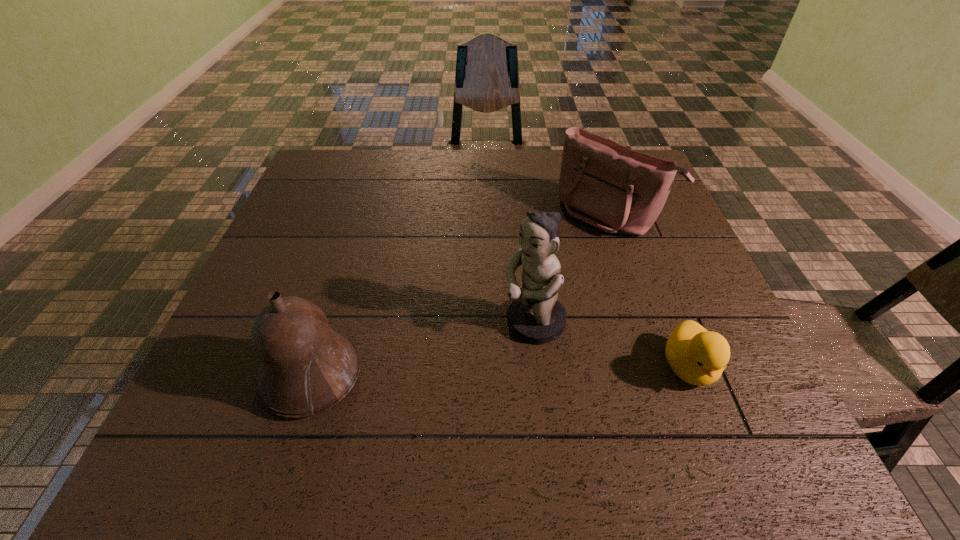
Locate an element on the screen. object that is at the near right corner is located at coordinates (697, 356).

The image size is (960, 540). In order to click on vacant space at the far edge in this screenshot , I will do `click(556, 162)`.

This screenshot has height=540, width=960. In the image, there is a desktop. Identify the location of vacant space at the near edge. (356, 409).

Find the location of a particular element. Image resolution: width=960 pixels, height=540 pixels. free space at the left edge of the desktop is located at coordinates (300, 196).

Image resolution: width=960 pixels, height=540 pixels. Identify the location of vacant area at the right edge. (686, 314).

In order to click on free region at the far left corner in this screenshot , I will do `click(356, 151)`.

Identify the location of free space at the near right corner of the desktop. This screenshot has width=960, height=540. (711, 400).

This screenshot has width=960, height=540. In order to click on empty space that is in between the shoulder bag and the shortest object in this screenshot , I will do `click(649, 291)`.

In order to click on free spot between the shoulder bag and the figurine in this screenshot , I will do `click(571, 268)`.

Locate an element on the screen. free space between the shoulder bag and the shortest object is located at coordinates (649, 291).